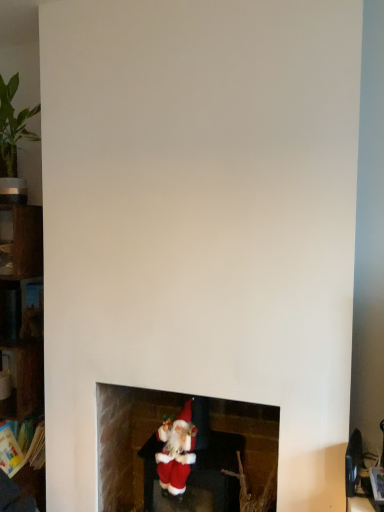
Question: From the image's perspective, is wooden shelf at left, positioned as the second shelf in top-to-bottom order, above or below metallic dark gray shelf at left, the second shelf positioned from the bottom?

Choices:
 (A) below
 (B) above

Answer: (A)

Question: Does point (21, 232) appear closer or farther from the camera than point (18, 288)?

Choices:
 (A) closer
 (B) farther

Answer: (A)

Question: Based on their relative distances, which object is farther from the green matte plant at lower center?

Choices:
 (A) wooden shelf at left, positioned as the second shelf in top-to-bottom order
 (B) metallic dark gray shelf at left, the second shelf positioned from the bottom
 (C) red plush santa at lower center
 (D) velvet santa at lower center

Answer: (B)

Question: Considering the real-world distances, which object is closest to the metallic dark gray shelf at left, the 1th shelf in the top-to-bottom sequence?

Choices:
 (A) velvet santa at lower center
 (B) red plush santa at lower center
 (C) green matte plant at lower center
 (D) wooden shelf at left, positioned as the second shelf in top-to-bottom order

Answer: (D)